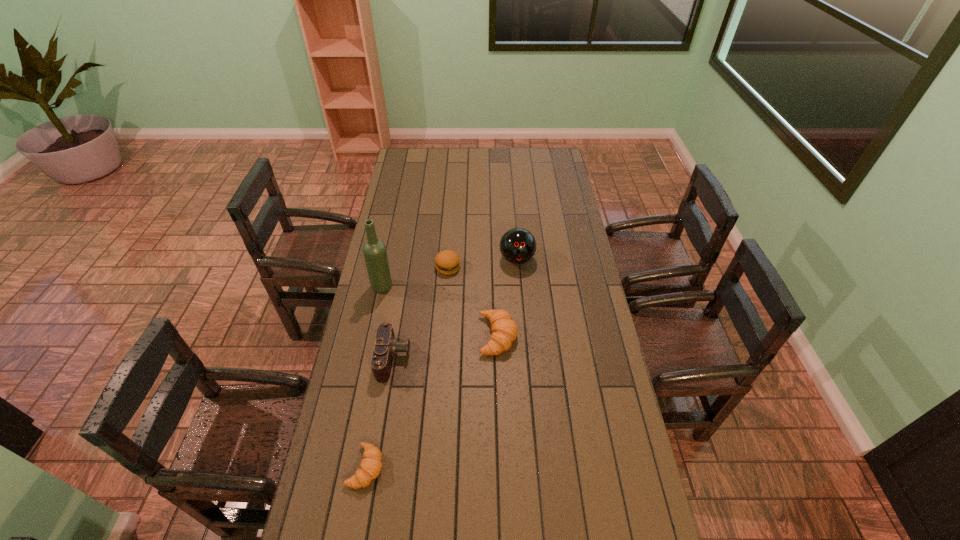
The width and height of the screenshot is (960, 540). Find the location of `vacant area at the left edge of the desktop`. vacant area at the left edge of the desktop is located at coordinates (398, 266).

The height and width of the screenshot is (540, 960). I want to click on free space at the right edge, so click(542, 213).

I want to click on free space at the far left corner of the desktop, so click(399, 161).

Locate an element on the screen. vacant space at the far right corner of the desktop is located at coordinates (545, 161).

Image resolution: width=960 pixels, height=540 pixels. Identify the location of vacant region at the near right corner of the desktop. click(x=592, y=519).

What are the coordinates of `free spot between the shorter crescent roll and the fifth shortest object` in the screenshot? It's located at point(442,363).

Locate an element on the screen. This screenshot has height=540, width=960. free space between the camera and the hamburger is located at coordinates (421, 313).

Locate an element on the screen. The image size is (960, 540). free space that is in between the tallest object and the hamburger is located at coordinates (415, 277).

Locate an element on the screen. The width and height of the screenshot is (960, 540). free spot between the right crescent roll and the tallest object is located at coordinates (440, 311).

Identify the location of empty space between the bowling ball and the left crescent roll. (442, 363).